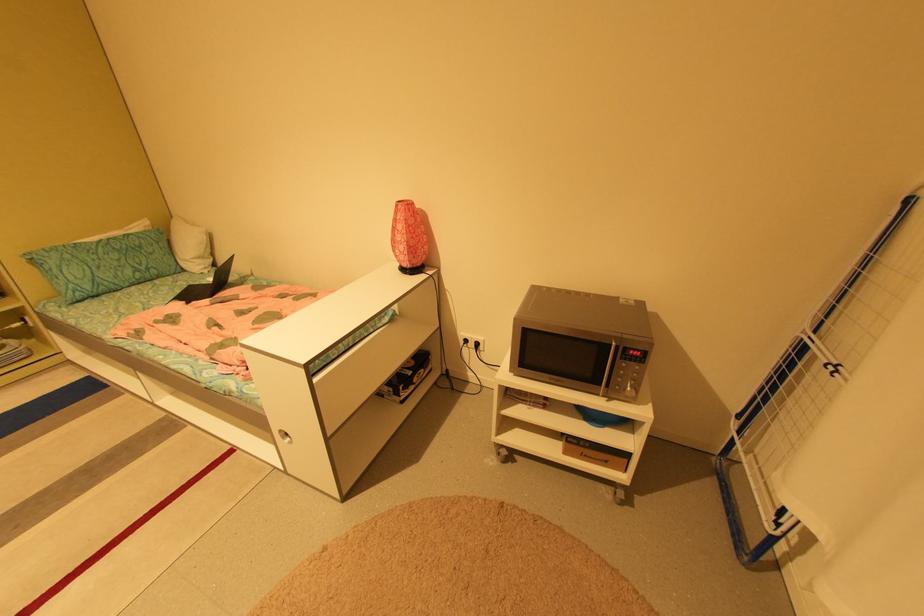
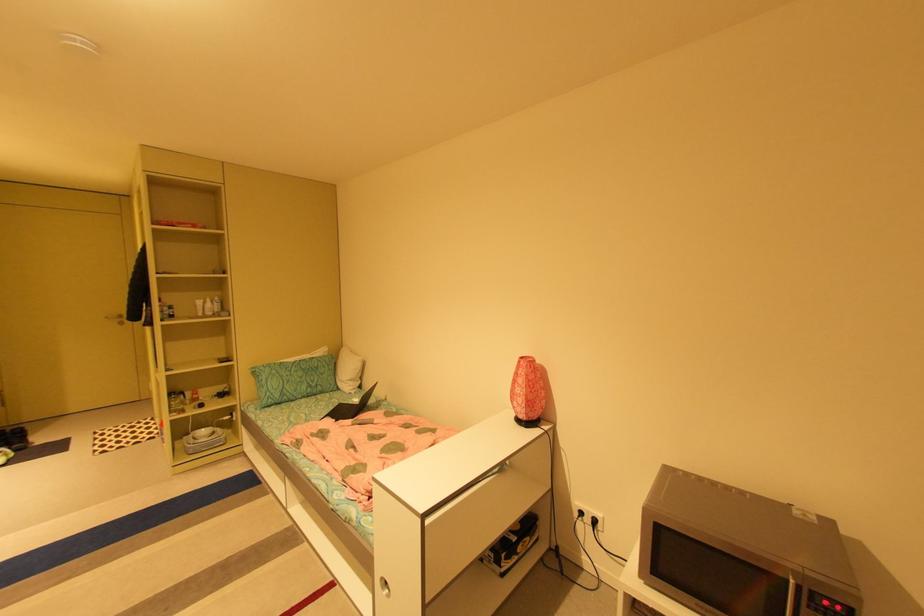
The images are taken continuously from a first-person perspective. In which direction is your viewpoint rotating?

The camera's rotation is toward left-up.